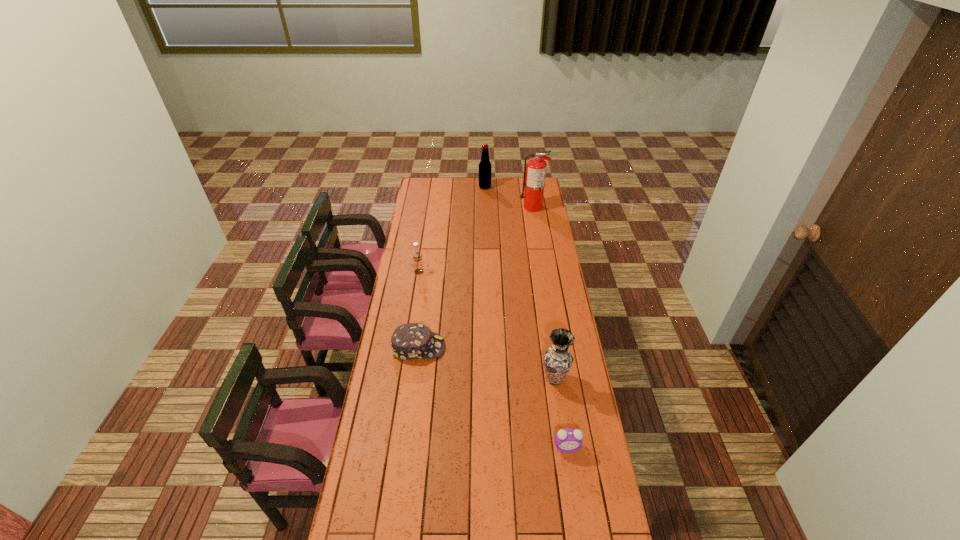
Locate an element on the screen. The width and height of the screenshot is (960, 540). vacant space that is in between the alarm clock and the fire extinguisher is located at coordinates (550, 327).

At what (x,y) coordinates should I click in order to perform the action: click on unoccupied position between the second nearest object and the alarm clock. Please return your answer as a coordinate pair (x, y). The width and height of the screenshot is (960, 540). Looking at the image, I should click on (561, 413).

Image resolution: width=960 pixels, height=540 pixels. Find the location of `vacant space that's between the fourth object from right to left and the tallest object`. vacant space that's between the fourth object from right to left and the tallest object is located at coordinates (509, 197).

Where is `vacant area between the farthest object and the second farthest object`? vacant area between the farthest object and the second farthest object is located at coordinates (509, 197).

Identify the location of free spot between the fifth farthest object and the beer bottle. The image size is (960, 540). (519, 283).

At what (x,y) coordinates should I click in order to perform the action: click on free space between the vase and the beer bottle. Please return your answer as a coordinate pair (x, y). Image resolution: width=960 pixels, height=540 pixels. Looking at the image, I should click on (519, 283).

Locate an element on the screen. This screenshot has width=960, height=540. the fourth closest object to the headwear is located at coordinates (535, 170).

At what (x,y) coordinates should I click in order to perform the action: click on object that is the third nearest to the alarm clock. Please return your answer as a coordinate pair (x, y). Image resolution: width=960 pixels, height=540 pixels. Looking at the image, I should click on (417, 258).

Find the location of a particular element. vacant space that satisfies the following two spatial constraints: 1. on the front side of the third object from left to right; 2. on the front-facing side of the headwear is located at coordinates (488, 347).

Find the location of `free space in the image that satisfies the following two spatial constraints: 1. at the nozzle of the fire extinguisher; 2. on the face of the nearest object`. free space in the image that satisfies the following two spatial constraints: 1. at the nozzle of the fire extinguisher; 2. on the face of the nearest object is located at coordinates (572, 447).